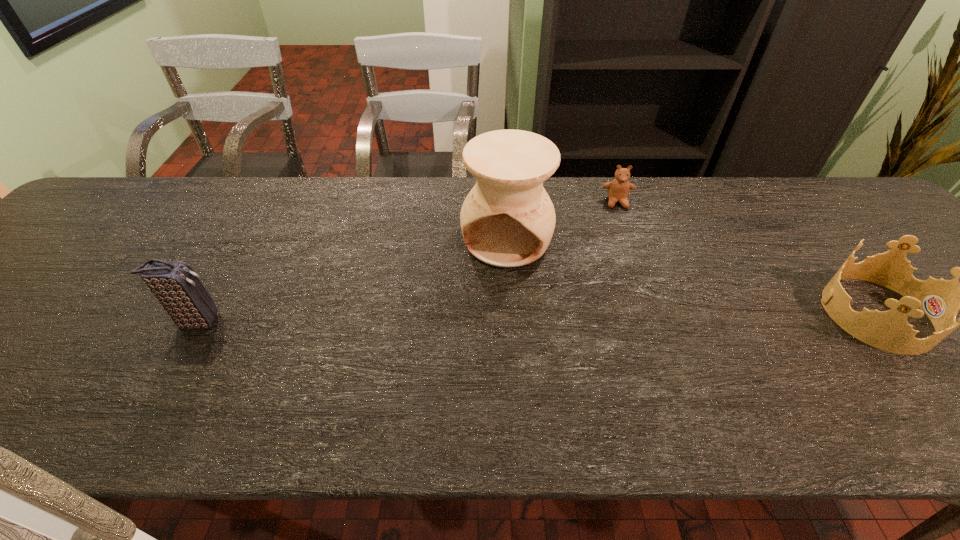
Where is `free region located 0.330m on the face of the shortest object`? This screenshot has width=960, height=540. free region located 0.330m on the face of the shortest object is located at coordinates (636, 298).

Find the location of a particular element. vacant space located on the face of the shortest object is located at coordinates (623, 233).

Image resolution: width=960 pixels, height=540 pixels. In order to click on free spot located on the face of the shortest object in this screenshot , I will do `click(638, 311)`.

Identify the location of pottery situated at the far edge. This screenshot has width=960, height=540. (507, 220).

At what (x,y) coordinates should I click in order to perform the action: click on teddy bear located in the far edge section of the desktop. Please return your answer as a coordinate pair (x, y). Looking at the image, I should click on (618, 189).

You are a GUI agent. You are given a task and a screenshot of the screen. Output one action in this format:
    pyautogui.click(x=<x>, y=<y>)
    Task: Click on the vacant space at the far edge
    
    Given the screenshot: What is the action you would take?
    pyautogui.click(x=764, y=177)

In the image, there is a desktop. Where is `vacant space at the near edge`? vacant space at the near edge is located at coordinates (287, 385).

Locate an element on the screen. free space at the left edge of the desktop is located at coordinates (82, 233).

Identify the location of free space at the far right corner of the desktop. The image size is (960, 540). click(x=838, y=199).

Identify the location of vacant space that's between the leftmost object and the shortest object. The height and width of the screenshot is (540, 960). (407, 262).